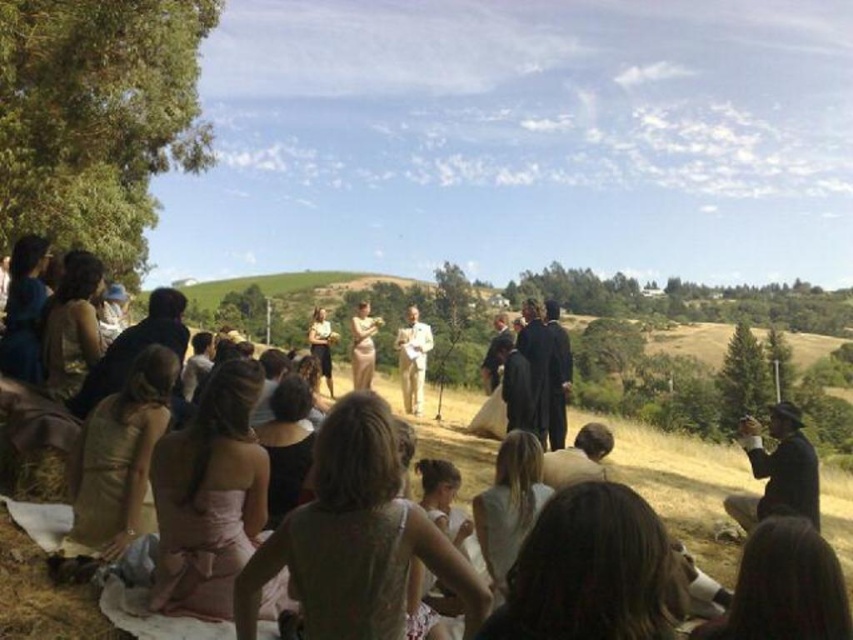
How far apart are matte white dress at center and black leather hat at lower right?

They are 18.22 feet apart.

What do you see at coordinates (680, 484) in the screenshot? I see `matte white dress at center` at bounding box center [680, 484].

The height and width of the screenshot is (640, 853). What are the coordinates of `matte white dress at center` in the screenshot? It's located at (680, 484).

Is black leather hat at lower right positioned before light beige suit at center?

Yes, black leather hat at lower right is closer to the viewer.

Does black leather hat at lower right have a greater width compared to light beige suit at center?

Yes, black leather hat at lower right is wider than light beige suit at center.

Is point (793, 456) behind point (415, 332)?

No, it is in front of (415, 332).

At what (x,y) coordinates should I click in order to perform the action: click on black leather hat at lower right. Please return your answer as a coordinate pair (x, y). The height and width of the screenshot is (640, 853). Looking at the image, I should click on (776, 468).

How far apart are matte white dress at center and light beige suit at center?

5.10 meters

Who is shorter, matte white dress at center or light beige suit at center?

Standing shorter between the two is light beige suit at center.

Locate an element on the screen. matte white dress at center is located at coordinates (680, 484).